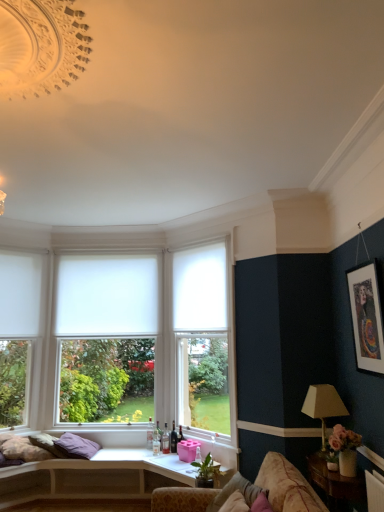
At what (x,y) coordinates should I click in order to perform the action: click on vacant area on top of white matte curtain at center, arranged as the first curtain when viewed from the right (from a real-world perspective). Please return your answer as a coordinate pair (x, y). Looking at the image, I should click on (195, 245).